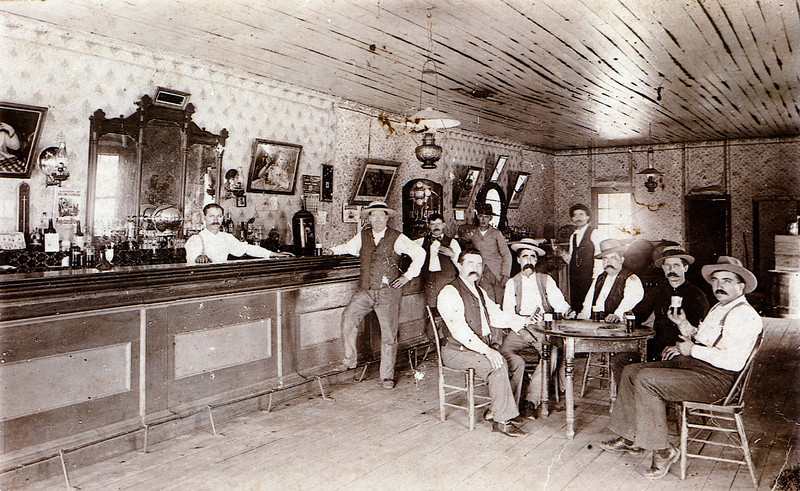
The width and height of the screenshot is (800, 491). I want to click on feet rail, so click(x=321, y=378), click(x=117, y=441).